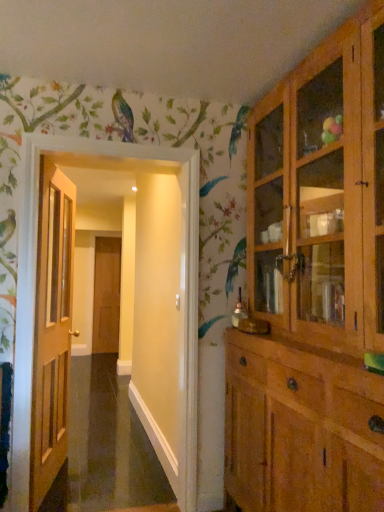
Question: Is brown wooden door at center, marked as the second door in a right-to-left arrangement, inside light brown wood cabinet at right?

Choices:
 (A) yes
 (B) no

Answer: (B)

Question: Is light brown wood cabinet at right beside brown wooden door at center, placed as the 2th door when sorted from front to back?

Choices:
 (A) no
 (B) yes

Answer: (A)

Question: Considering the relative positions of light brown wood cabinet at right and brown wooden door at center, marked as the 1th door in a left-to-right arrangement, in the image provided, is light brown wood cabinet at right to the right of brown wooden door at center, marked as the 1th door in a left-to-right arrangement, from the viewer's perspective?

Choices:
 (A) no
 (B) yes

Answer: (B)

Question: Can you confirm if light brown wood cabinet at right is taller than brown wooden door at center, marked as the 1th door in a left-to-right arrangement?

Choices:
 (A) yes
 (B) no

Answer: (A)

Question: Is light brown wood cabinet at right oriented towards brown wooden door at center, marked as the second door in a right-to-left arrangement?

Choices:
 (A) yes
 (B) no

Answer: (B)

Question: Does light brown wood cabinet at right have a smaller size compared to brown wooden door at center, marked as the second door in a right-to-left arrangement?

Choices:
 (A) no
 (B) yes

Answer: (A)

Question: From a real-world perspective, does brown wooden door at center, the 1th door from the back, sit lower than light brown wood cabinet at right?

Choices:
 (A) no
 (B) yes

Answer: (B)

Question: Is brown wooden door at center, marked as the 1th door in a left-to-right arrangement, smaller than light brown wood cabinet at right?

Choices:
 (A) yes
 (B) no

Answer: (A)

Question: Does brown wooden door at center, the 1th door from the back, have a larger size compared to light brown wood cabinet at right?

Choices:
 (A) no
 (B) yes

Answer: (A)

Question: Is brown wooden door at center, the 1th door from the back, beside light brown wood cabinet at right?

Choices:
 (A) no
 (B) yes

Answer: (A)

Question: Considering the relative sizes of brown wooden door at center, the 1th door from the back, and light brown wood cabinet at right in the image provided, is brown wooden door at center, the 1th door from the back, shorter than light brown wood cabinet at right?

Choices:
 (A) yes
 (B) no

Answer: (A)

Question: Would you consider brown wooden door at center, the 1th door from the back, to be distant from light brown wood cabinet at right?

Choices:
 (A) no
 (B) yes

Answer: (B)

Question: Is light brown wood cabinet at right taller than wooden door at left, which ranks as the first door in front-to-back order?

Choices:
 (A) no
 (B) yes

Answer: (B)